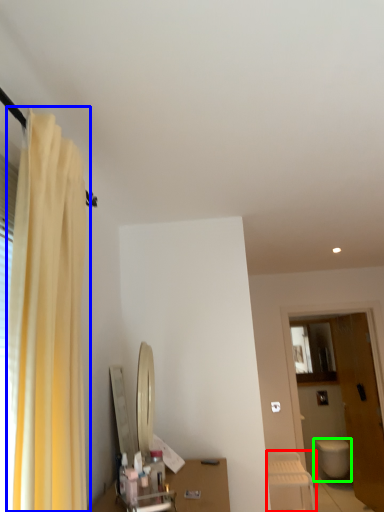
Question: Considering the real-world distances, which object is farthest from furniture (highlighted by a red box)? curtain (highlighted by a blue box) or toilet (highlighted by a green box)?

Choices:
 (A) curtain
 (B) toilet

Answer: (A)